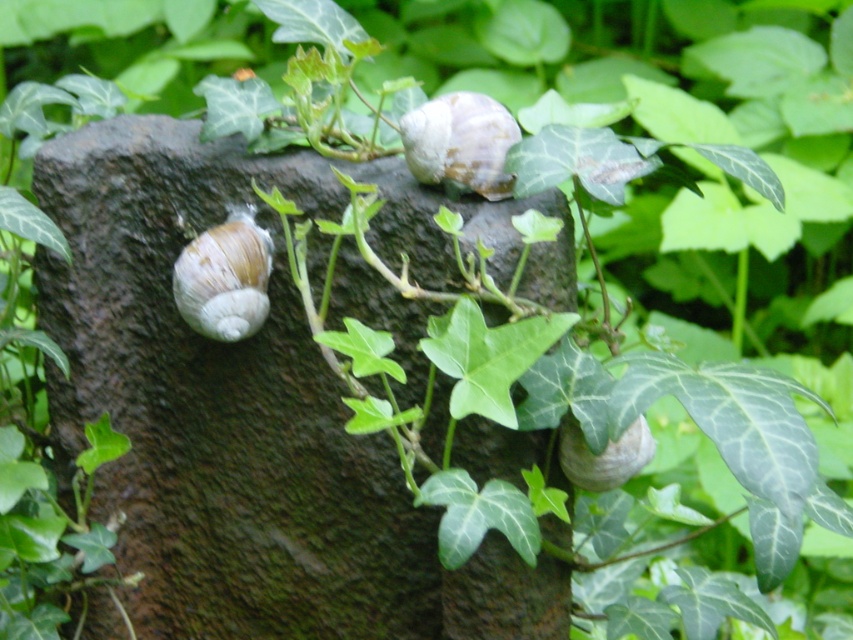
Does matte brown shell at left have a smaller size compared to shiny white shell at lower right?

Incorrect, matte brown shell at left is not smaller in size than shiny white shell at lower right.

Which is more to the left, matte brown shell at left or shiny white shell at lower right?

Positioned to the left is matte brown shell at left.

Which is in front, point (259, 324) or point (611, 451)?

Point (611, 451)

At what (x,y) coordinates should I click in order to perform the action: click on matte brown shell at left. Please return your answer as a coordinate pair (x, y). This screenshot has width=853, height=640. Looking at the image, I should click on (225, 278).

Can you confirm if matte brown shell at left is shorter than white matte snail at upper center?

No.

Does matte brown shell at left have a greater height compared to white matte snail at upper center?

Yes.

Who is more distant from viewer, (x=241, y=337) or (x=454, y=173)?

The point (x=241, y=337) is more distant.

Image resolution: width=853 pixels, height=640 pixels. Find the location of `matte brown shell at left`. matte brown shell at left is located at coordinates (225, 278).

Can you confirm if white matte snail at upper center is positioned to the right of shiny white shell at lower right?

In fact, white matte snail at upper center is to the left of shiny white shell at lower right.

What do you see at coordinates (460, 141) in the screenshot? This screenshot has width=853, height=640. I see `white matte snail at upper center` at bounding box center [460, 141].

Find the location of a particular element. This screenshot has width=853, height=640. white matte snail at upper center is located at coordinates (460, 141).

This screenshot has width=853, height=640. What are the coordinates of `white matte snail at upper center` in the screenshot? It's located at (460, 141).